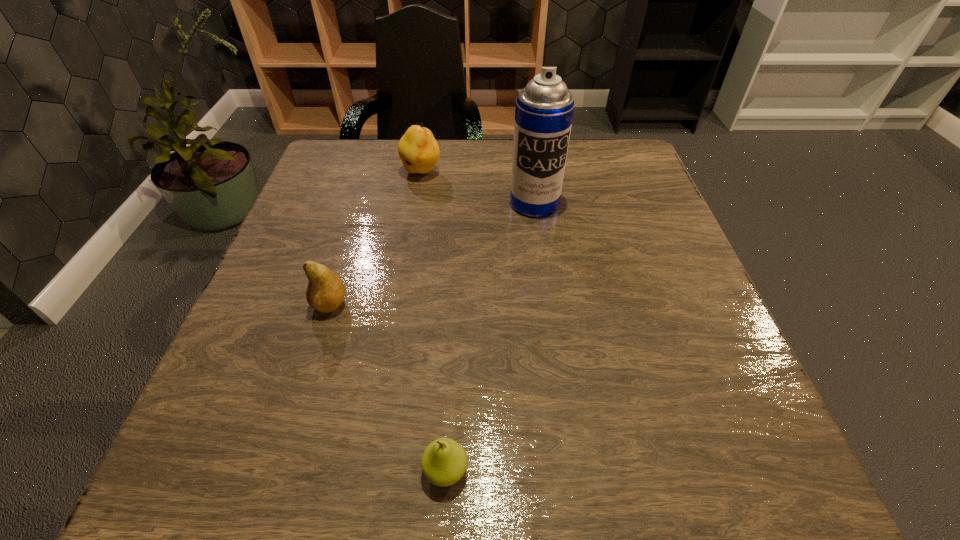
This screenshot has height=540, width=960. What are the coordinates of `free area in between the third nearest object and the second pear from right to left` in the screenshot? It's located at (x=478, y=188).

Locate an element on the screen. The height and width of the screenshot is (540, 960). empty location between the aerosol can and the nearest pear is located at coordinates (490, 337).

Locate an element on the screen. This screenshot has height=540, width=960. free space that is in between the leftmost object and the shortest pear is located at coordinates (388, 387).

You are a GUI agent. You are given a task and a screenshot of the screen. Output one action in this format:
    pyautogui.click(x=<x>, y=<y>)
    Task: Click on the object that can be found as the closest to the shortest object
    
    Given the screenshot: What is the action you would take?
    pyautogui.click(x=325, y=292)

Locate an element on the screen. object that is the second closest to the second pear from left to right is located at coordinates (325, 292).

The image size is (960, 540). Find the location of `pear object that ranks as the closest to the second pear from left to right`. pear object that ranks as the closest to the second pear from left to right is located at coordinates (325, 292).

Identify which pear is the nearest to the second nearest object. Please provide its 2D coordinates. Your answer should be formatted as a tuple, i.e. [(x, y)], where the tuple contains the x and y coordinates of a point satisfying the conditions above.

[(444, 461)]